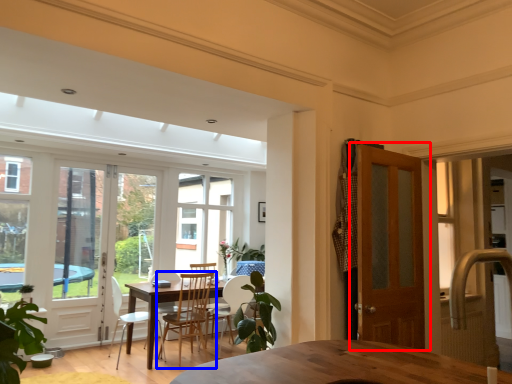
Question: Which point is closer to the camera, door (highlighted by a red box) or chair (highlighted by a blue box)?

Choices:
 (A) door
 (B) chair

Answer: (A)